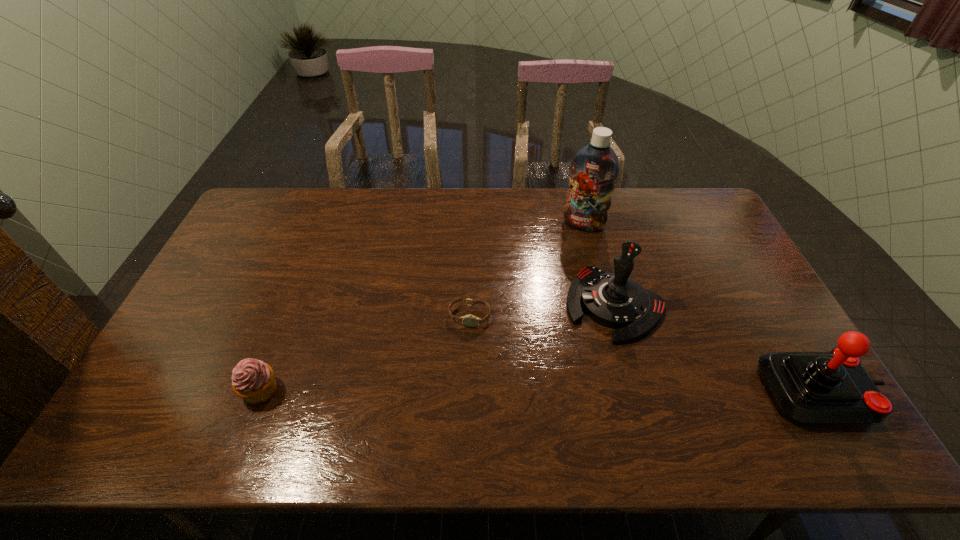
Where is `cupcake that is positioned at the near edge`? This screenshot has width=960, height=540. cupcake that is positioned at the near edge is located at coordinates (253, 380).

At what (x,y) coordinates should I click in order to perform the action: click on joystick located at the near edge. Please return your answer as a coordinate pair (x, y). Looking at the image, I should click on (832, 387).

At what (x,y) coordinates should I click in order to perform the action: click on object present at the right edge. Please return your answer as a coordinate pair (x, y). The width and height of the screenshot is (960, 540). Looking at the image, I should click on (832, 387).

This screenshot has height=540, width=960. What are the coordinates of `object at the near right corner` in the screenshot? It's located at (832, 387).

Where is `free space at the far edge`? free space at the far edge is located at coordinates (370, 197).

In the image, there is a desktop. Where is `vacant space at the near edge`? vacant space at the near edge is located at coordinates (599, 388).

Where is `free space at the left edge of the desktop`? free space at the left edge of the desktop is located at coordinates [x=250, y=275].

The width and height of the screenshot is (960, 540). Find the location of `free spot at the right edge of the desktop`. free spot at the right edge of the desktop is located at coordinates (772, 313).

In the image, there is a desktop. At what (x,y) coordinates should I click in order to perform the action: click on vacant space at the far left corner. Please return your answer as a coordinate pair (x, y). This screenshot has width=960, height=540. Looking at the image, I should click on tap(297, 188).

Find the location of a particular element. This screenshot has height=540, width=960. vacant space at the far right corner is located at coordinates (694, 200).